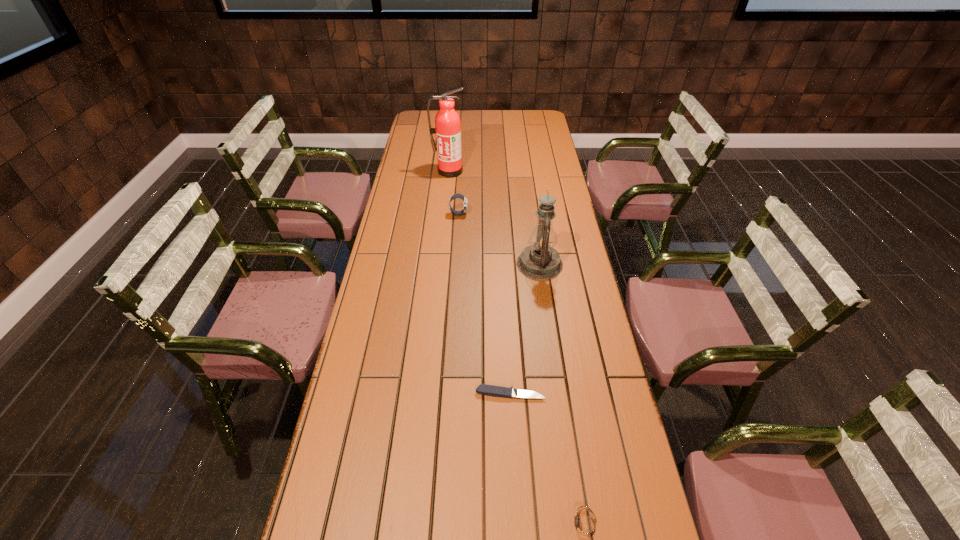
What are the coordinates of `vacant area that satisfies the following two spatial constraints: 1. on the face of the shortest object; 2. on the right side of the farther watch` in the screenshot? It's located at (448, 393).

Locate an element on the screen. The width and height of the screenshot is (960, 540). vacant space that satisfies the following two spatial constraints: 1. on the label side of the tallest object; 2. on the right side of the third nearest object is located at coordinates (440, 264).

You are a GUI agent. You are given a task and a screenshot of the screen. Output one action in this format:
    pyautogui.click(x=<x>, y=<y>)
    Task: Click on the free space that satisfies the following two spatial constraints: 1. on the label side of the fire extinguisher; 2. on the left side of the shortest object
    
    Given the screenshot: What is the action you would take?
    pyautogui.click(x=427, y=393)

Locate an element on the screen. This screenshot has height=540, width=960. vacant position in the image that satisfies the following two spatial constraints: 1. on the back side of the shortest object; 2. on the face of the farther watch is located at coordinates (500, 214).

At what (x,y) coordinates should I click in order to perform the action: click on free space that satisfies the following two spatial constraints: 1. on the face of the second nearest object; 2. on the left side of the taller watch. Please return your answer as a coordinate pair (x, y). Looking at the image, I should click on (448, 393).